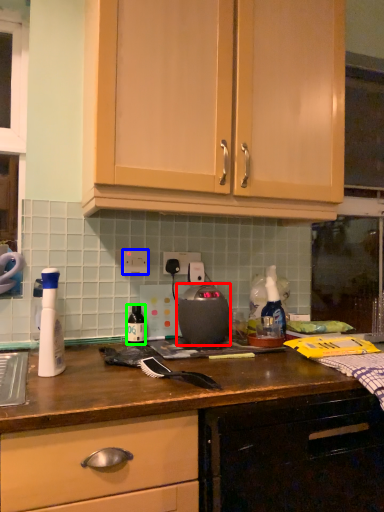
Question: Considering the real-world distances, which object is closest to home appliance (highlighted by a red box)? electric outlet (highlighted by a blue box) or bottle (highlighted by a green box).

Choices:
 (A) electric outlet
 (B) bottle

Answer: (B)